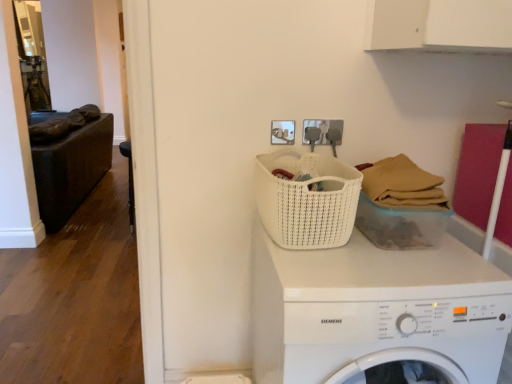
This screenshot has height=384, width=512. I want to click on white woven basket at center, which is counted as the second basket, starting from the right, so click(x=307, y=200).

Identify the location of white woven basket at center, which is the second basket in left-to-right order. (401, 205).

Locate an element on the screen. Image resolution: width=512 pixels, height=384 pixels. white plastic washing machine at center is located at coordinates (375, 311).

Are black leather chair at left and white woven basket at center, which is the second basket in left-to-right order, far apart?

Yes, black leather chair at left and white woven basket at center, which is the second basket in left-to-right order, are quite far apart.

From the image's perspective, is black leather chair at left below white woven basket at center, which is counted as the first basket, starting from the right?

Actually, black leather chair at left appears above white woven basket at center, which is counted as the first basket, starting from the right, in the image.

Is black leather chair at left to the left of white woven basket at center, which is counted as the first basket, starting from the right, from the viewer's perspective?

Yes, black leather chair at left is to the left of white woven basket at center, which is counted as the first basket, starting from the right.

From a real-world perspective, is white woven basket at center, placed as the first basket when sorted from left to right, above or below white woven basket at center, which is the second basket in left-to-right order?

white woven basket at center, placed as the first basket when sorted from left to right, is above white woven basket at center, which is the second basket in left-to-right order.

In terms of width, does white woven basket at center, placed as the first basket when sorted from left to right, look wider or thinner when compared to white woven basket at center, which is counted as the first basket, starting from the right?

Clearly, white woven basket at center, placed as the first basket when sorted from left to right, has more width compared to white woven basket at center, which is counted as the first basket, starting from the right.

Consider the image. Does white woven basket at center, which is counted as the second basket, starting from the right, have a larger size compared to white woven basket at center, which is counted as the first basket, starting from the right?

Yes, white woven basket at center, which is counted as the second basket, starting from the right, is bigger than white woven basket at center, which is counted as the first basket, starting from the right.

Measure the distance between white woven basket at center, which is the second basket in left-to-right order, and white woven basket at center, placed as the first basket when sorted from left to right.

white woven basket at center, which is the second basket in left-to-right order, and white woven basket at center, placed as the first basket when sorted from left to right, are 7.10 inches apart from each other.

Is white woven basket at center, which is the second basket in left-to-right order, not close to white woven basket at center, which is counted as the second basket, starting from the right?

That's not correct — white woven basket at center, which is the second basket in left-to-right order, is a little close to white woven basket at center, which is counted as the second basket, starting from the right.

Where is `basket located below the white woven basket at center, placed as the first basket when sorted from left to right (from the image's perspective)`? basket located below the white woven basket at center, placed as the first basket when sorted from left to right (from the image's perspective) is located at coordinates (401, 205).

Which is behind, point (265, 154) or point (127, 146)?

The point (127, 146) is behind.

Looking at this image, from a real-world perspective, is white woven basket at center, placed as the first basket when sorted from left to right, above or below black leather chair at left?

white woven basket at center, placed as the first basket when sorted from left to right, is above black leather chair at left.

Is white woven basket at center, which is counted as the second basket, starting from the right, directly adjacent to black leather chair at left?

No, white woven basket at center, which is counted as the second basket, starting from the right, is not beside black leather chair at left.

At what (x,y) coordinates should I click in order to perform the action: click on chair on the left of white woven basket at center, which is counted as the second basket, starting from the right. Please return your answer as a coordinate pair (x, y). Looking at the image, I should click on (129, 181).

In the scene shown: Between black leather chair at left and white plastic washing machine at center, which one has larger size?

With larger size is white plastic washing machine at center.

Is black leather chair at left positioned far away from white plastic washing machine at center?

Yes, black leather chair at left and white plastic washing machine at center are located far from each other.

Is black leather chair at left wider or thinner than white plastic washing machine at center?

Clearly, black leather chair at left has less width compared to white plastic washing machine at center.

Consider the image. In terms of height, does black leather chair at left look taller or shorter compared to white plastic washing machine at center?

black leather chair at left is shorter than white plastic washing machine at center.

Is white woven basket at center, which is counted as the first basket, starting from the right, thinner than white plastic washing machine at center?

Correct, the width of white woven basket at center, which is counted as the first basket, starting from the right, is less than that of white plastic washing machine at center.

From the picture: Are white woven basket at center, which is the second basket in left-to-right order, and white plastic washing machine at center far apart?

No, white woven basket at center, which is the second basket in left-to-right order, is not far away from white plastic washing machine at center.

Considering the positions of objects white woven basket at center, which is counted as the first basket, starting from the right, and white plastic washing machine at center in the image provided, who is more to the left, white woven basket at center, which is counted as the first basket, starting from the right, or white plastic washing machine at center?

white plastic washing machine at center.

Who is taller, white woven basket at center, which is the second basket in left-to-right order, or white plastic washing machine at center?

With more height is white plastic washing machine at center.

Would you say white woven basket at center, which is counted as the second basket, starting from the right, is part of black leather chair at left's contents?

No, black leather chair at left does not contain white woven basket at center, which is counted as the second basket, starting from the right.

Is black leather chair at left wider than white woven basket at center, placed as the first basket when sorted from left to right?

Incorrect, the width of black leather chair at left does not surpass that of white woven basket at center, placed as the first basket when sorted from left to right.

From a real-world perspective, does black leather chair at left sit lower than white woven basket at center, which is counted as the second basket, starting from the right?

Yes, from a real-world perspective, black leather chair at left is under white woven basket at center, which is counted as the second basket, starting from the right.

Between black leather chair at left and white woven basket at center, which is counted as the second basket, starting from the right, which one is positioned behind?

black leather chair at left is further from the camera.

This screenshot has height=384, width=512. Find the location of `basket that is the 1st one when counting forward from the black leather chair at left`. basket that is the 1st one when counting forward from the black leather chair at left is located at coordinates (401, 205).

Find the location of a particular element. basket behind the white woven basket at center, which is counted as the second basket, starting from the right is located at coordinates (401, 205).

Considering their positions, is white woven basket at center, which is counted as the first basket, starting from the right, positioned further to black leather chair at left than white plastic washing machine at center?

white plastic washing machine at center.

Considering their positions, is white woven basket at center, which is counted as the second basket, starting from the right, positioned closer to white woven basket at center, which is counted as the first basket, starting from the right, than white plastic washing machine at center?

white woven basket at center, which is counted as the second basket, starting from the right, lies closer to white woven basket at center, which is counted as the first basket, starting from the right, than the other object.

Looking at this image, estimate the real-world distances between objects in this image. Which object is further from black leather chair at left, white woven basket at center, placed as the first basket when sorted from left to right, or white woven basket at center, which is the second basket in left-to-right order?

Based on the image, white woven basket at center, which is the second basket in left-to-right order, appears to be further to black leather chair at left.

Looking at the image, which one is located closer to white woven basket at center, placed as the first basket when sorted from left to right, white woven basket at center, which is the second basket in left-to-right order, or black leather chair at left?

white woven basket at center, which is the second basket in left-to-right order, lies closer to white woven basket at center, placed as the first basket when sorted from left to right, than the other object.

Which object lies nearer to the anchor point white woven basket at center, which is counted as the second basket, starting from the right, black leather chair at left or white plastic washing machine at center?

white plastic washing machine at center is closer to white woven basket at center, which is counted as the second basket, starting from the right.

Considering their positions, is white woven basket at center, which is counted as the second basket, starting from the right, positioned closer to black leather chair at left than white plastic washing machine at center?

The object closer to black leather chair at left is white woven basket at center, which is counted as the second basket, starting from the right.

Based on their spatial positions, is white woven basket at center, which is counted as the second basket, starting from the right, or black leather chair at left further from white plastic washing machine at center?

black leather chair at left is positioned further to the anchor white plastic washing machine at center.

In the scene shown: Considering their positions, is black leather chair at left positioned further to white woven basket at center, placed as the first basket when sorted from left to right, than white woven basket at center, which is the second basket in left-to-right order?

black leather chair at left lies further to white woven basket at center, placed as the first basket when sorted from left to right, than the other object.

This screenshot has height=384, width=512. In order to click on basket that lies between white woven basket at center, which is counted as the second basket, starting from the right, and white plastic washing machine at center from top to bottom in this screenshot , I will do `click(401, 205)`.

Find the location of `basket between white woven basket at center, which is counted as the second basket, starting from the right, and black leather chair at left, along the z-axis`. basket between white woven basket at center, which is counted as the second basket, starting from the right, and black leather chair at left, along the z-axis is located at coordinates (401, 205).